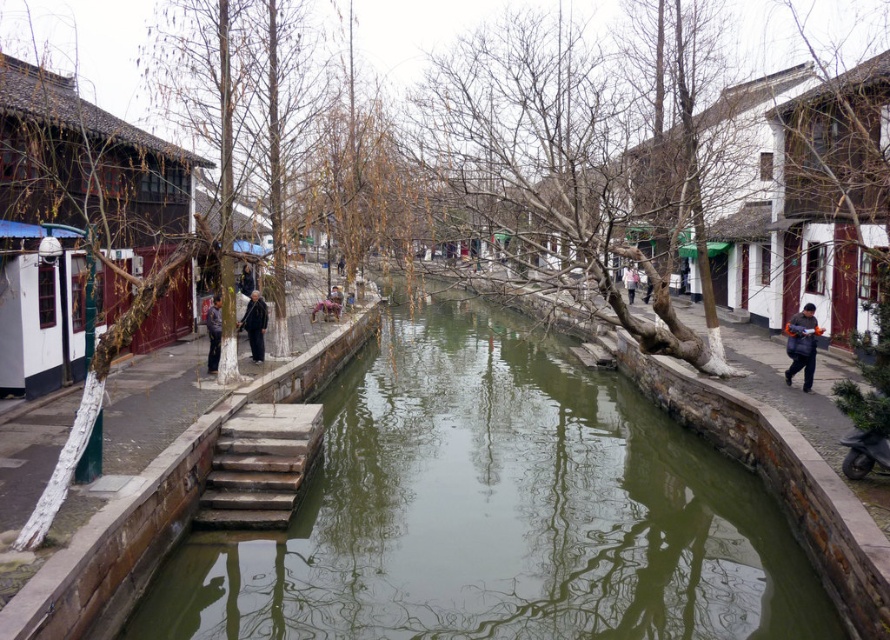
Based on the photo, you are standing at the edge of the canal and see both the wooden stairs at center and the light brown leather jacket at center. Which object is nearer to you?

The wooden stairs at center is closer to the viewer than the light brown leather jacket at center, so the wooden stairs at center is nearer to you.

You are standing at the edge of the canal and want to take a photo that includes both point A at point (176, 579) and point B at point (256, 292). Which point will appear larger in your photo?

Point A at point (176, 579) will appear larger in the photo because it is closer to the camera than point B at point (256, 292).

You are a delivery person trying to carry a light brown leather jacket at center up the wooden stairs at center. Considering the stairs width, will you have enough space to walk up while holding the jacket?

The wooden stairs at center has a lesser width compared to light brown leather jacket at center, so the stairs are narrower than the jacket. This means the jacket may not fit comfortably, making it difficult to carry it up the stairs.